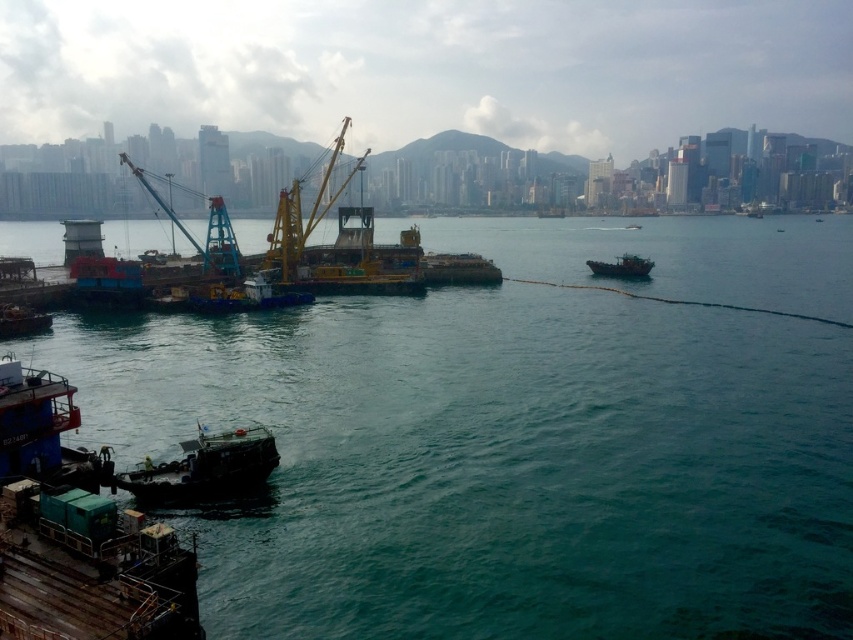
You are a harbor worker who needs to choose a boat for a task that requires a wider vessel to carry heavy equipment. Based on the scene, which boat between the dark gray metallic boat at lower left and the rusty metal boat at center right should you select?

The rusty metal boat at center right is wider than the dark gray metallic boat at lower left, so you should choose the rusty metal boat at center right for carrying heavy equipment.

You are a drone operator trying to locate a specific point in the harbor scene. The point you need to reach is labeled as point (498, 461). According to the scene description, which object does this point correspond to?

The point (498, 461) corresponds to the teal water at center.